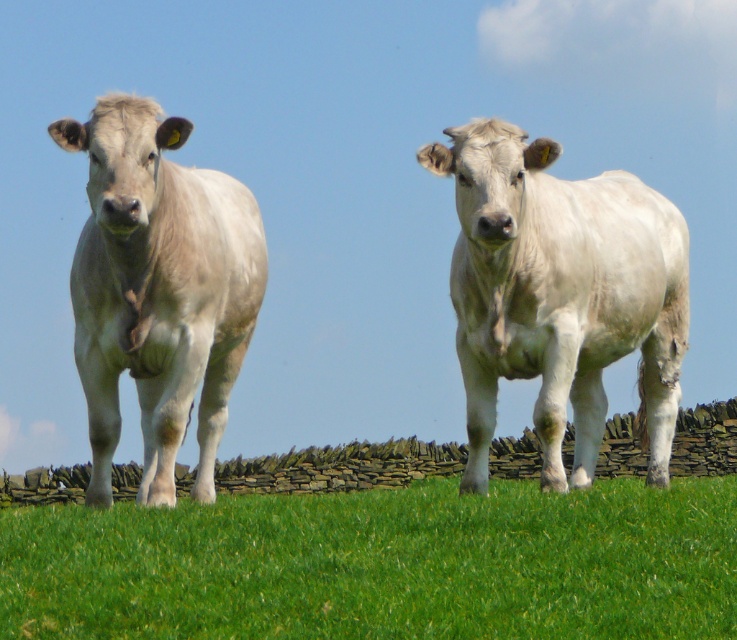
Question: Which point is closer to the camera taking this photo?

Choices:
 (A) (677, 586)
 (B) (251, 248)
 (C) (539, 248)

Answer: (A)

Question: Which of these objects is positioned closest to the green grass at lower center?

Choices:
 (A) white matte cow at center
 (B) light gray smooth cow at center

Answer: (B)

Question: Which of the following is the farthest from the observer?

Choices:
 (A) green grass at lower center
 (B) light gray smooth cow at center
 (C) white matte cow at center

Answer: (C)

Question: Does green grass at lower center come behind light gray smooth cow at center?

Choices:
 (A) yes
 (B) no

Answer: (B)

Question: Does green grass at lower center lie behind light gray smooth cow at center?

Choices:
 (A) no
 (B) yes

Answer: (A)

Question: Observing the image, what is the correct spatial positioning of white matte cow at center in reference to light gray smooth cow at center?

Choices:
 (A) below
 (B) above

Answer: (A)